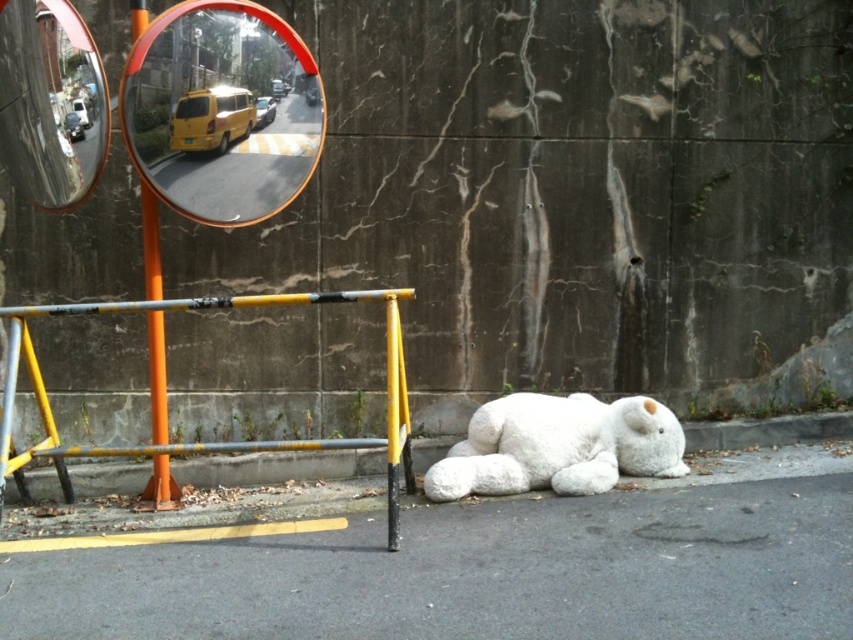
Consider the image. Does orange reflective convex mirror at upper left appear over orange plastic pole at left?

Yes, orange reflective convex mirror at upper left is above orange plastic pole at left.

Is orange reflective convex mirror at upper left wider than orange plastic pole at left?

Yes.

Locate an element on the screen. Image resolution: width=853 pixels, height=640 pixels. orange reflective convex mirror at upper left is located at coordinates (221, 109).

Does point (732, 618) come in front of point (154, 346)?

Yes, point (732, 618) is closer to viewer.

Between gray asphalt at lower center and orange plastic pole at left, which one appears on the right side from the viewer's perspective?

gray asphalt at lower center is more to the right.

The height and width of the screenshot is (640, 853). In order to click on gray asphalt at lower center in this screenshot , I will do `click(479, 573)`.

At what (x,y) coordinates should I click in order to perform the action: click on gray asphalt at lower center. Please return your answer as a coordinate pair (x, y). Looking at the image, I should click on (479, 573).

Consider the image. Does gray asphalt at lower center have a lesser width compared to white plush bear at lower right?

No.

Can you confirm if gray asphalt at lower center is positioned to the left of white plush bear at lower right?

Indeed, gray asphalt at lower center is positioned on the left side of white plush bear at lower right.

The image size is (853, 640). I want to click on gray asphalt at lower center, so click(479, 573).

Where is `gray asphalt at lower center`? This screenshot has width=853, height=640. gray asphalt at lower center is located at coordinates (479, 573).